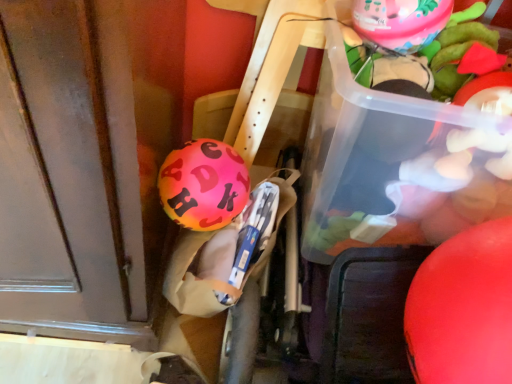
Question: Is point (206, 140) positioned closer to the camera than point (374, 172)?

Choices:
 (A) closer
 (B) farther

Answer: (B)

Question: From their relative heights in the image, would you say shiny pink balloon at center, the 2th balloon from the bottom, is taller or shorter than translucent plastic container at upper right?

Choices:
 (A) tall
 (B) short

Answer: (B)

Question: Based on their relative distances, which object is farther from the shiny pink balloon at center, arranged as the first balloon when viewed from the left?

Choices:
 (A) rubber matte balloon at right, which is the 3th balloon in top-to-bottom order
 (B) pink rubber balloon at upper right, positioned as the 2th balloon in left-to-right order
 (C) translucent plastic container at upper right

Answer: (A)

Question: Which of these objects is positioned farthest from the translucent plastic container at upper right?

Choices:
 (A) pink rubber balloon at upper right, placed as the third balloon when sorted from bottom to top
 (B) shiny pink balloon at center, arranged as the first balloon when viewed from the left
 (C) rubber matte balloon at right, the first balloon in the right-to-left sequence

Answer: (B)